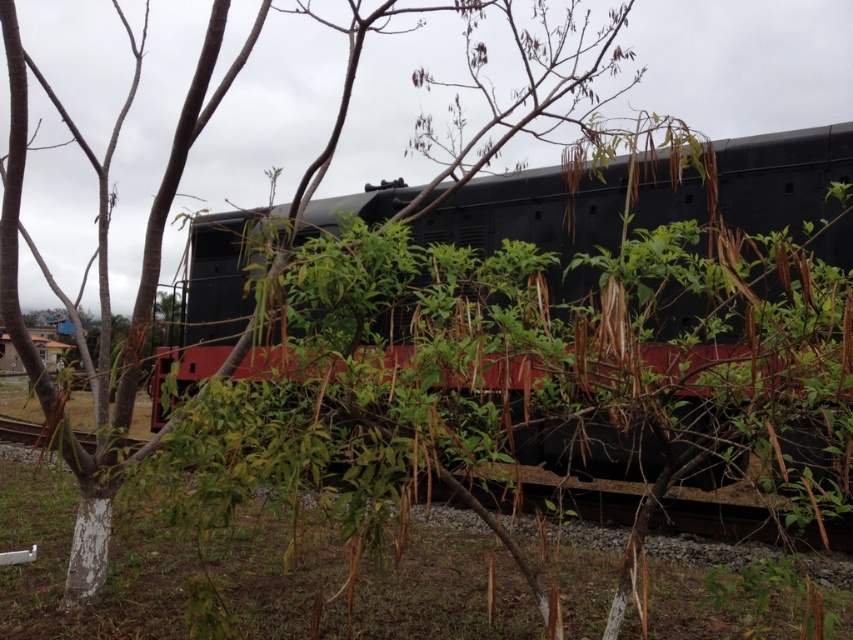
Question: From the image, what is the correct spatial relationship of matte black train at center in relation to black metal train track at center?

Choices:
 (A) above
 (B) below

Answer: (A)

Question: Which point appears closest to the camera in this image?

Choices:
 (A) (457, 234)
 (B) (570, 497)

Answer: (B)

Question: In this image, where is matte black train at center located relative to black metal train track at center?

Choices:
 (A) right
 (B) left

Answer: (A)

Question: Which point is farther to the camera?

Choices:
 (A) matte black train at center
 (B) black metal train track at center

Answer: (A)

Question: Does matte black train at center appear under black metal train track at center?

Choices:
 (A) no
 (B) yes

Answer: (A)